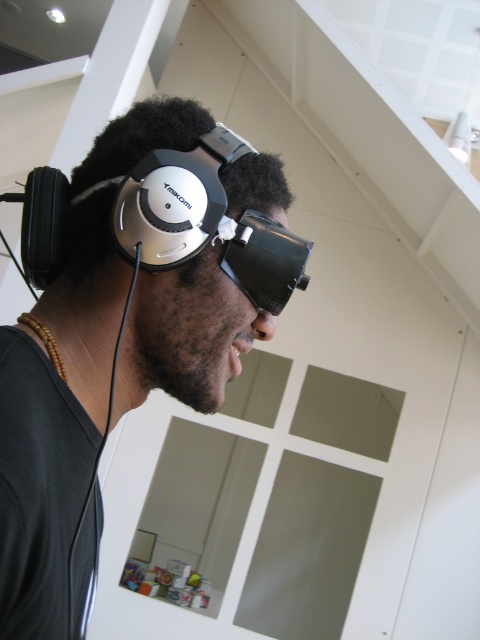
You are setting up a VR setup for a user who requires the headphones to be positioned exactly 40 centimeters away from their face. Based on the scene described, is the current placement of the matte black headphones at left appropriate?

The matte black headphones at left are positioned 39.56 centimeters away from the camera, which is just slightly under the required 40 centimeters. Therefore, the current placement is almost correct but may need a minor adjustment to meet the exact requirement.

You are designing a layout for a tech product catalog and need to place the matte black headphones at left precisely at point (128, 326). The catalog requires all items to be placed within a 0.5x0.5 grid. Is the point within the grid?

The matte black headphones at left is located at point (128, 326). Since both coordinates are within the 0.5x0.5 grid range, it is within the required area.